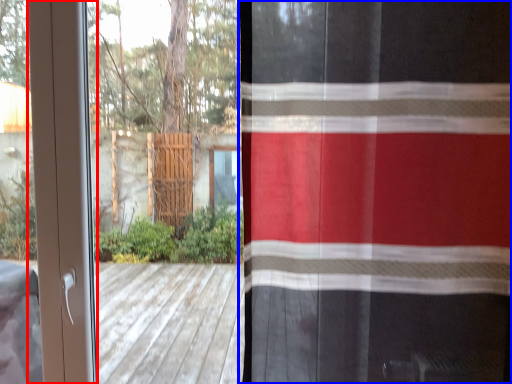
Question: Among these objects, which one is farthest to the camera, screen door (highlighted by a red box) or curtain (highlighted by a blue box)?

Choices:
 (A) screen door
 (B) curtain

Answer: (A)